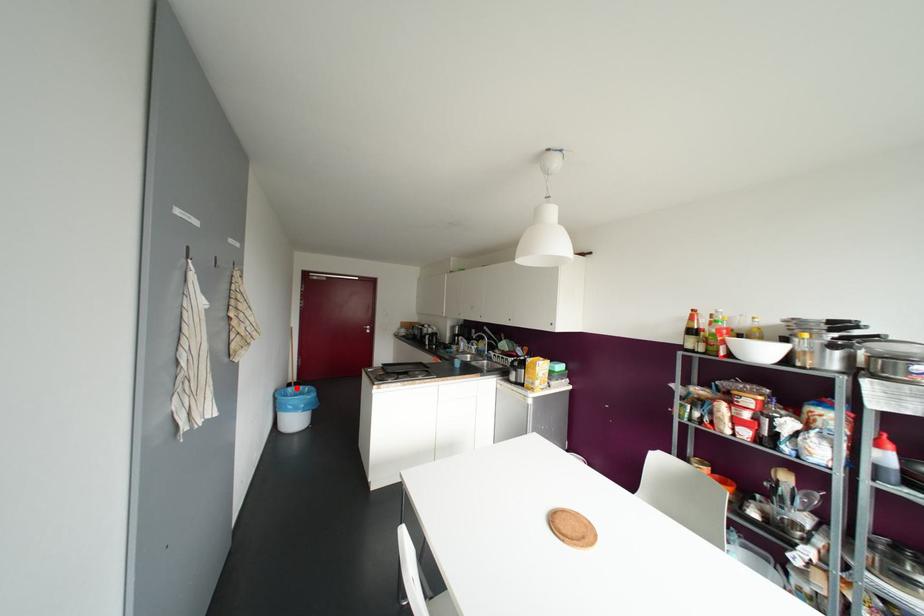
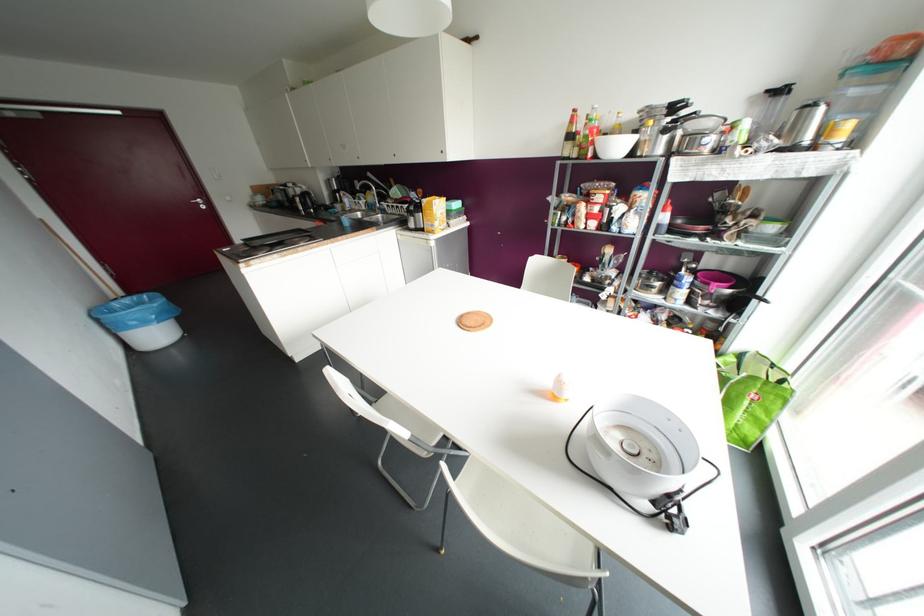
The point at the highlighted location is marked in the first image. Where is the corresponding point in the second image?

(127, 300)